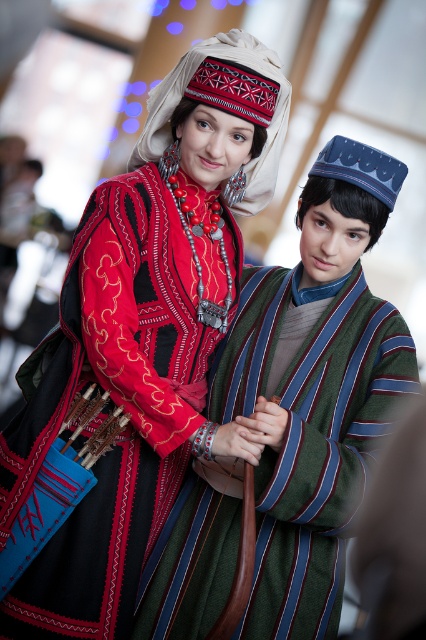
You are standing in the same room as the two individuals in the image. If you want to walk towards the person on the right, which point should you head towards, point A at coordinates point (365,330) or point B at coordinates point (271,118)?

You should head towards point B at coordinates point (271,118) because point A at coordinates point (365,330) is behind point B, meaning the person on the right is closer to you at point B.

You are standing in the center of the room and want to hand a gift to the person wearing the striped wool robe at center. In which direction should you move to reach them?

The striped wool robe at center is located at point 2D coordinates (322, 460), so you should move towards the lower right direction to reach them.

You are a photographer adjusting your camera settings to capture the striped wool robe at center and the embroidered fabric headdress at upper center. Which object should you focus on first to ensure both are in sharp focus?

The striped wool robe at center is closer to the viewer than the embroidered fabric headdress at upper center, so focus on the robe first. This will ensure the headdress remains in focus as well due to the depth of field.